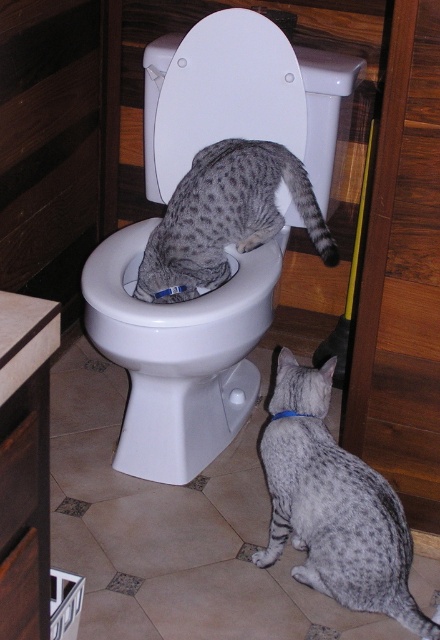
You are a cat owner who wants to ensure your cats can safely interact with the toilet. Given the white glossy toilet bowl at center is positioned at coordinates point 0.555, 0.407, can you determine if the cats are positioned in a way that allows them to both access the toilet bowl without overlapping each other?

The cats are positioned such that the tabby cat is on the closed lid of the toilet bowl at center, while the lighter tabby cat is sitting on the floor facing it. Since the white glossy toilet bowl at center is at point (179, 355), the cats are placed in different locations relative to the toilet, allowing them to access it without overlapping.

You are a cat owner trying to understand your cats in the bathroom. You see two points marked in the scene. One is at point (200, 467) and the other at point (266, 240). Which point is closer to you as you look at the image?

Point (200, 467) is closer to you than point (266, 240) because it is further to the viewer in the scene.